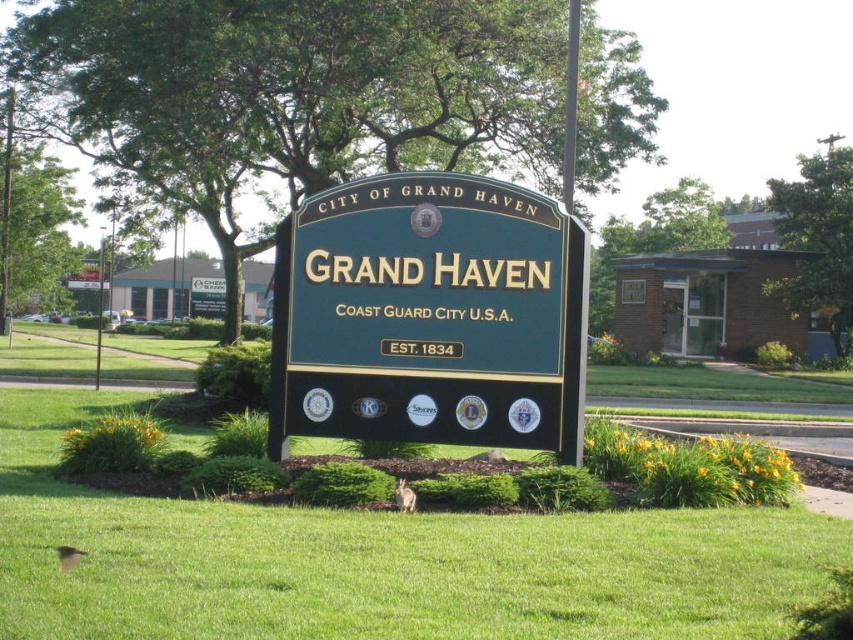
You are standing in front of the City of Grand Haven signboard. There are green grass at center and green polished wood sign at center. Which object is located higher?

The green polished wood sign at center is higher than the green grass at center because the grass is below the sign.

You are a delivery robot with a height of 1.5 meters. You are approaching the green polished wood sign at center and need to deliver a package to the green grass at center. Can you safely navigate the path between them without hitting your head?

The distance between the green grass at center and the green polished wood sign at center is 2.39 meters. Since the robot is 1.5 meters tall, it can safely navigate the path as the vertical clearance is sufficient.

You are a visitor standing at the entrance of the City of Grand Haven. You see the green grass at center and the green polished wood sign at center. Which object is taller?

The green polished wood sign at center is taller than the green grass at center.